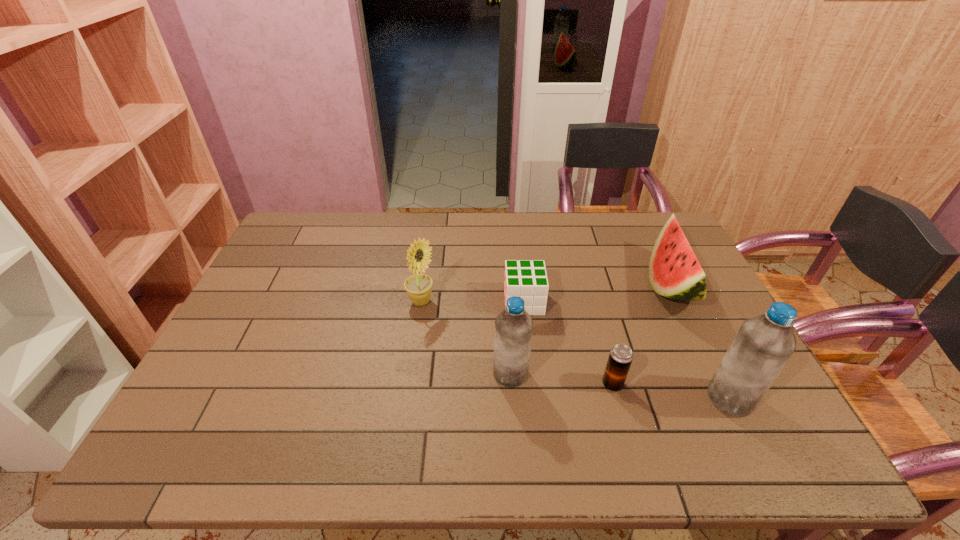
This screenshot has height=540, width=960. Identify the location of free spot that satisfies the following two spatial constraints: 1. on the red face of the tallest object; 2. on the left side of the cube. (534, 399).

Locate an element on the screen. The height and width of the screenshot is (540, 960). vacant space that satisfies the following two spatial constraints: 1. on the face of the sunflower; 2. on the back side of the left water bottle is located at coordinates (411, 374).